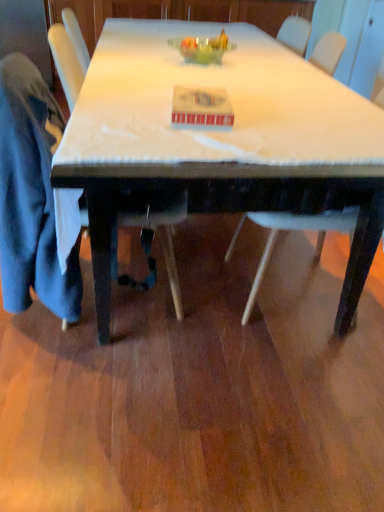
Locate an element on the screen. This screenshot has height=512, width=384. free space in front of white plastic chair at lower right, positioned as the 1th chair in right-to-left order is located at coordinates (284, 382).